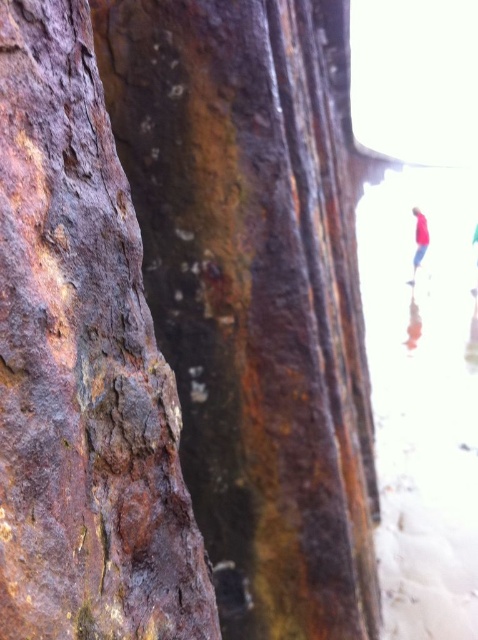
Is rusty metal rock at left to the left of red fabric shirt at upper right from the viewer's perspective?

Yes, rusty metal rock at left is to the left of red fabric shirt at upper right.

Locate an element on the screen. rusty metal rock at left is located at coordinates (82, 365).